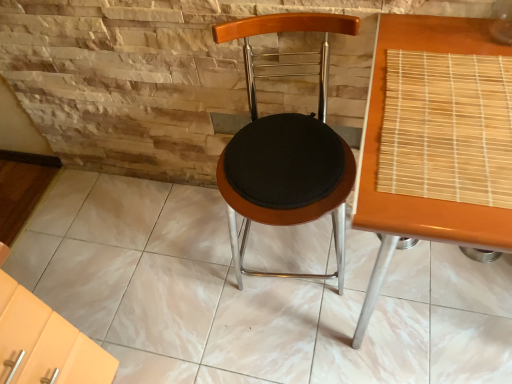
Find the location of a particular element. vacant space underneath bamboo mat at right (from a real-world perspective) is located at coordinates (459, 124).